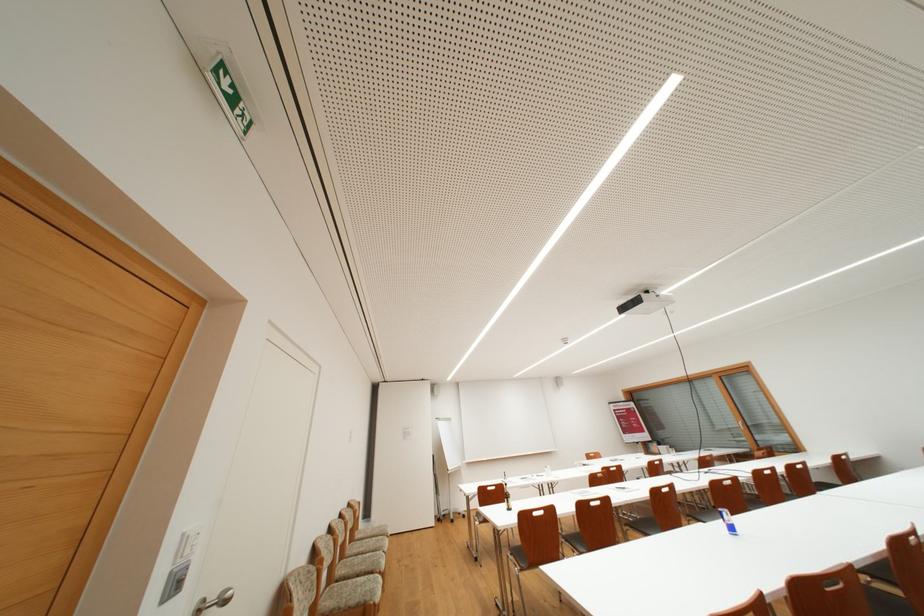
This screenshot has width=924, height=616. Describe the element at coordinates (213, 601) in the screenshot. I see `a metal door handle` at that location.